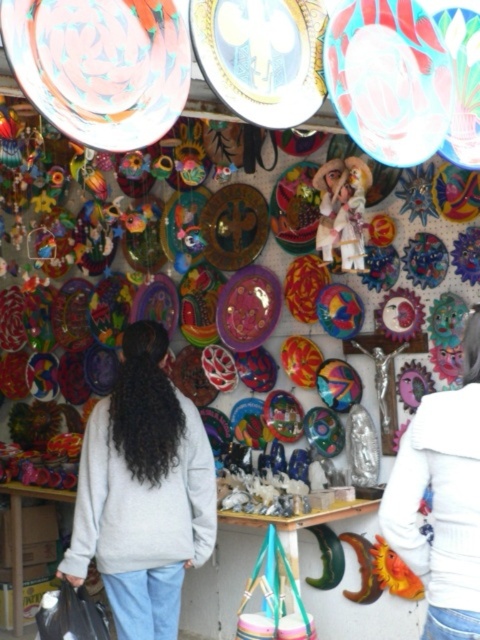
Question: Does matte multicolored plate at upper left appear over white matte jacket at upper right?

Choices:
 (A) no
 (B) yes

Answer: (B)

Question: Among these objects, which one is farthest from the camera?

Choices:
 (A) matte ceramic plate at center
 (B) gray matte sweatshirt at center
 (C) matte multicolored plate at upper center

Answer: (B)

Question: Which point is farther to the camera?

Choices:
 (A) matte multicolored plate at upper center
 (B) matte multicolored plate at upper left
 (C) matte ceramic plate at center
 (D) white matte jacket at upper right

Answer: (A)

Question: Can you confirm if matte ceramic plate at center is positioned below shiny purple plate at center?

Choices:
 (A) no
 (B) yes

Answer: (A)

Question: Does matte multicolored plate at upper center appear under metallic gold mask at center?

Choices:
 (A) yes
 (B) no

Answer: (B)

Question: Based on their relative distances, which object is farther from the matte multicolored plate at upper left?

Choices:
 (A) matte multicolored plate at upper center
 (B) shiny purple plate at center
 (C) matte ceramic plate at center

Answer: (B)